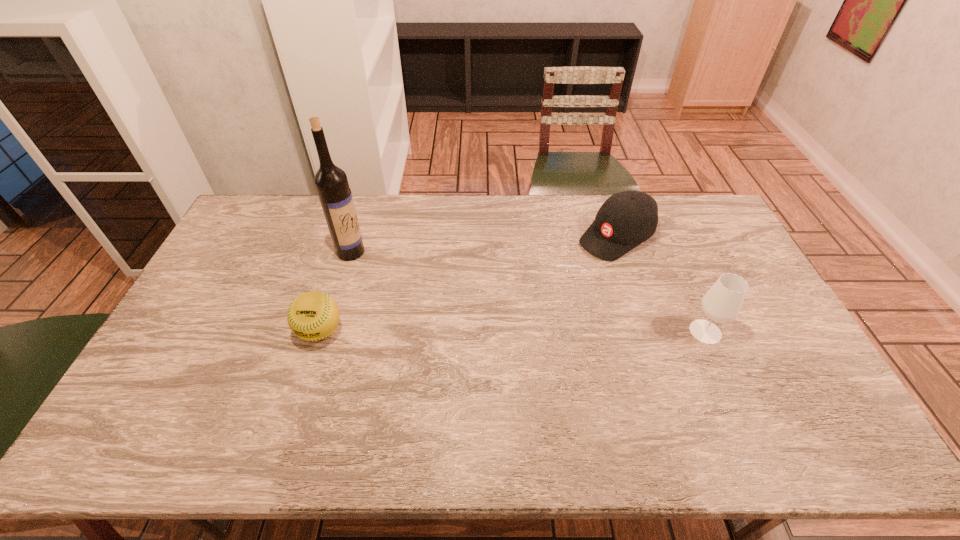
The image size is (960, 540). I want to click on vacant space on the desktop that is between the softball and the third shortest object and is positioned with a logo on the front of the baseball cap, so click(x=473, y=332).

This screenshot has width=960, height=540. I want to click on vacant spot on the desktop that is between the softball and the second tallest object and is positioned on the label of the wine bottle, so click(490, 332).